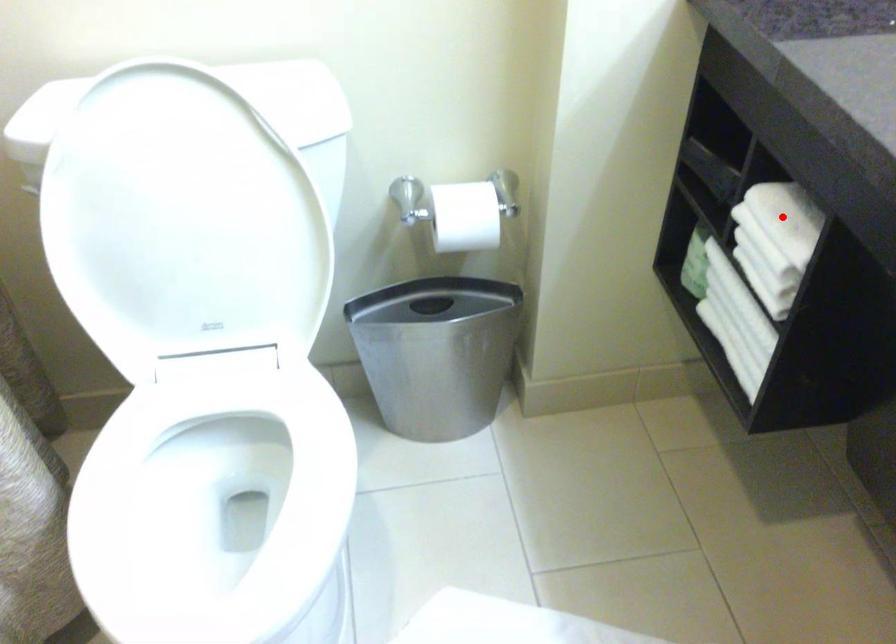
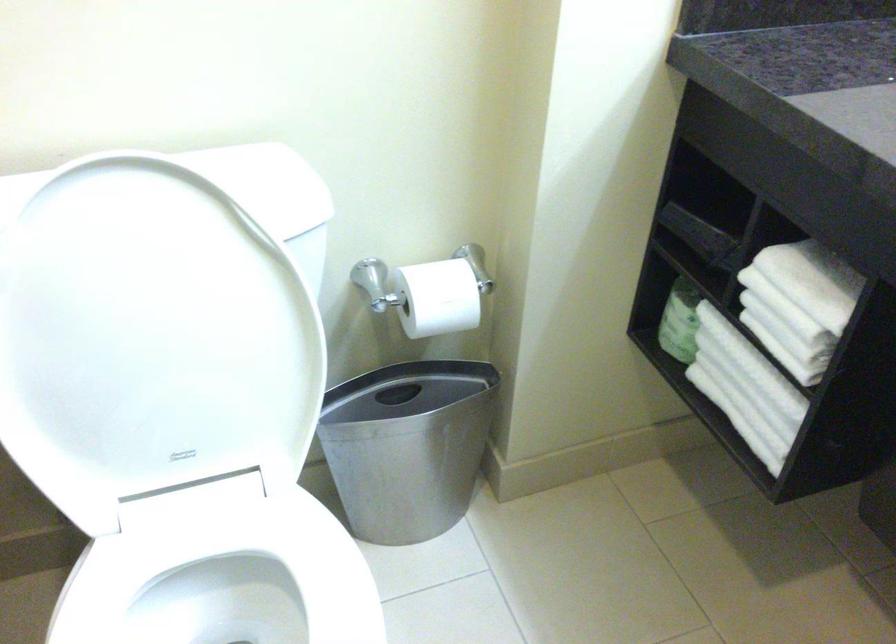
Find the pixel in the second image that matches the highlighted location in the first image.

(806, 281)